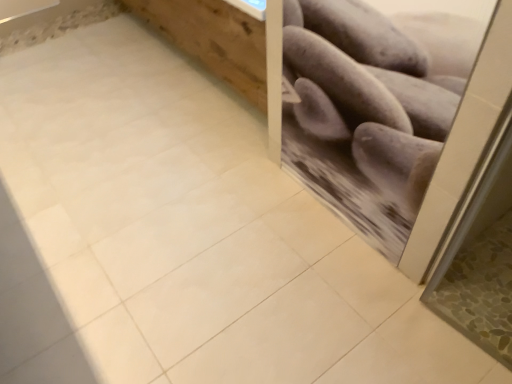
This screenshot has width=512, height=384. What are the coordinates of `vacant space that is to the left of gray matte potatoes at upper right` in the screenshot? It's located at (251, 221).